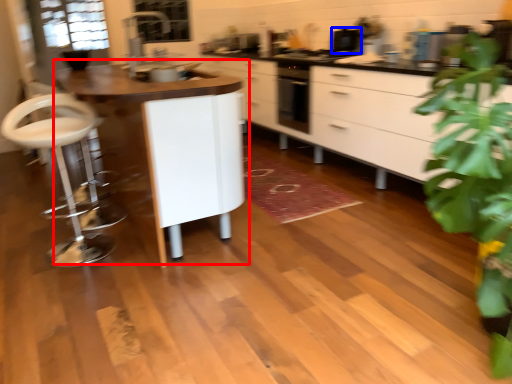
Question: Which of the following is the farthest to the observer, table (highlighted by a red box) or appliance (highlighted by a blue box)?

Choices:
 (A) table
 (B) appliance

Answer: (B)